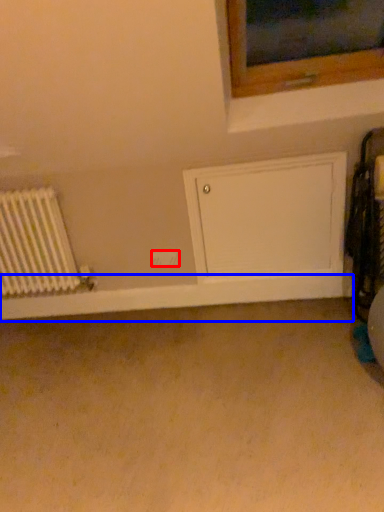
Question: Which of the following is the closest to the observer, electric outlet (highlighted by a red box) or window sill (highlighted by a blue box)?

Choices:
 (A) electric outlet
 (B) window sill

Answer: (B)